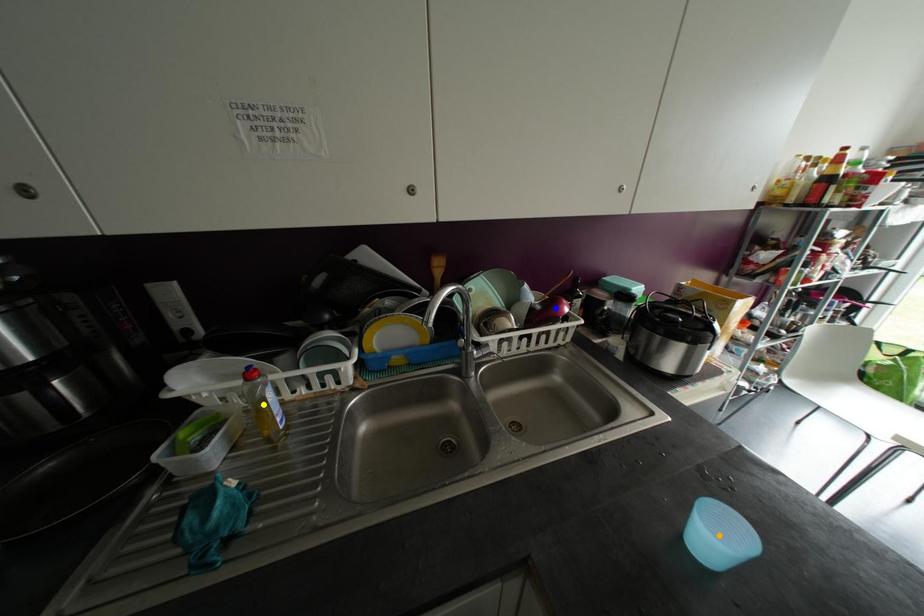
Order these from farthest to nearest:
yellow point | blue point | orange point

blue point
yellow point
orange point